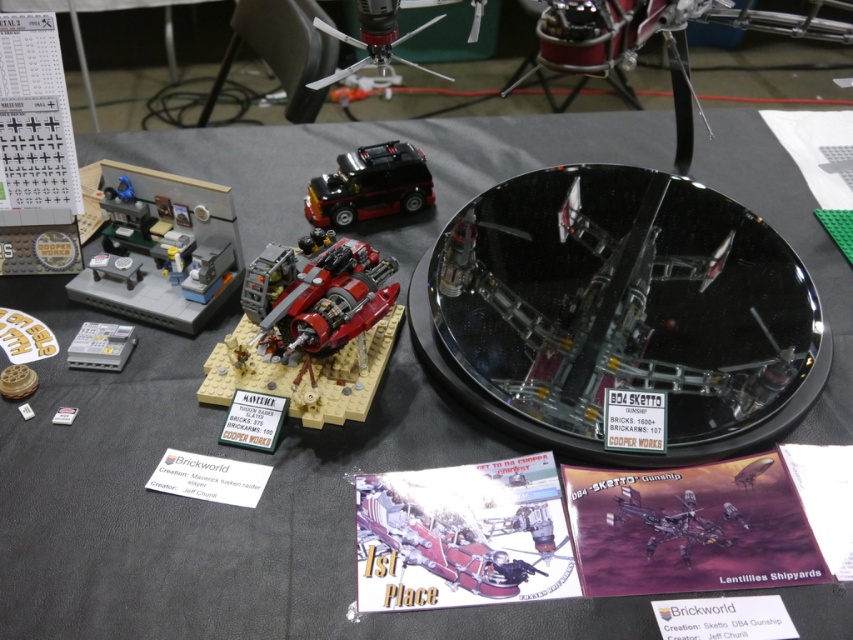
You are a judge at the LEGO competition and need to determine the arrangement of the two models. Which LEGO model is placed to the left of the other? The matte black vehicle at center and the metallic silver gunship at center are both on the table.

The matte black vehicle at center is positioned on the left side of the metallic silver gunship at center, so the matte black vehicle at center is to the left of the metallic silver gunship at center.

You are a judge at a LEGO competition and need to place a trophy on the table. The trophy is too heavy for the LEGO models but can be placed on the black glass plate at center or metallic silver gunship at center. Which surface should you choose based on their positions?

The black glass plate at center is positioned on the left side of the metallic silver gunship at center, so the judge should place the trophy on the black glass plate at center since it is a stable surface and likely more suitable for holding heavy items compared to the LEGO gunship model.